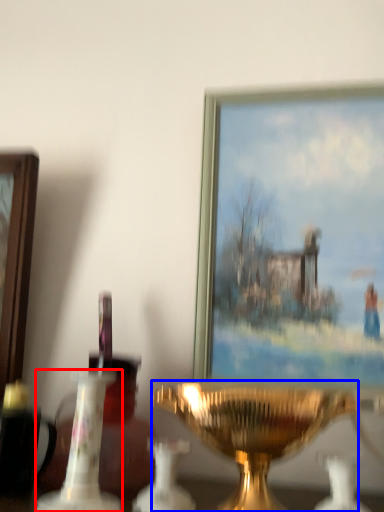
Question: Which of the following is the closest to the observer, candle holder (highlighted by a red box) or candle holder (highlighted by a blue box)?

Choices:
 (A) candle holder
 (B) candle holder

Answer: (B)